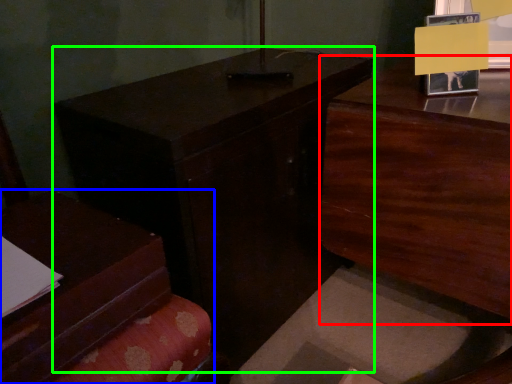
Question: Which object is positioned closest to dresser (highlighted by a red box)? Select from furniture (highlighted by a blue box) and table (highlighted by a green box).

Choices:
 (A) furniture
 (B) table

Answer: (B)